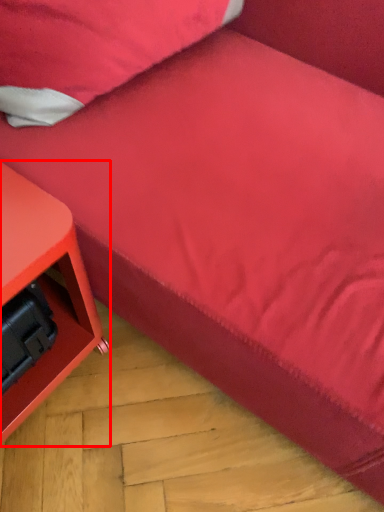
Question: In this image, where is furniture (annotated by the red box) located relative to pillow?

Choices:
 (A) right
 (B) left

Answer: (B)